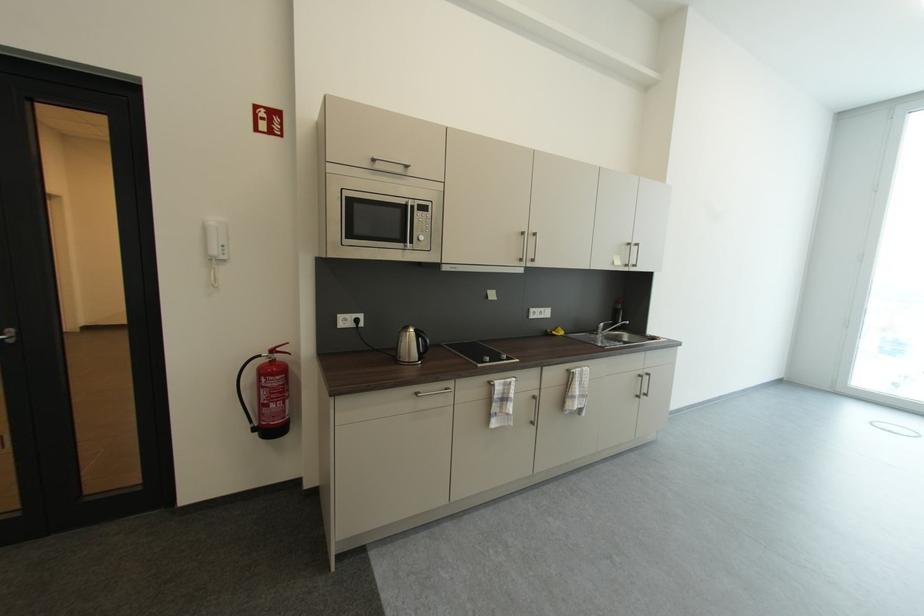
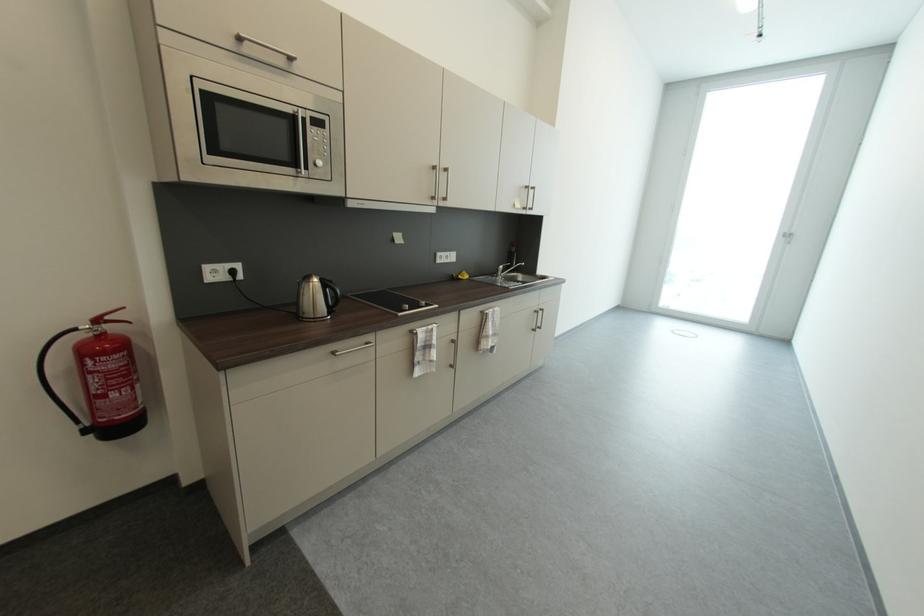
Question: The first image is from the beginning of the video and the second image is from the end. How did the camera likely rotate when shooting the video?

Choices:
 (A) Left
 (B) Right
 (C) Up
 (D) Down

Answer: (B)